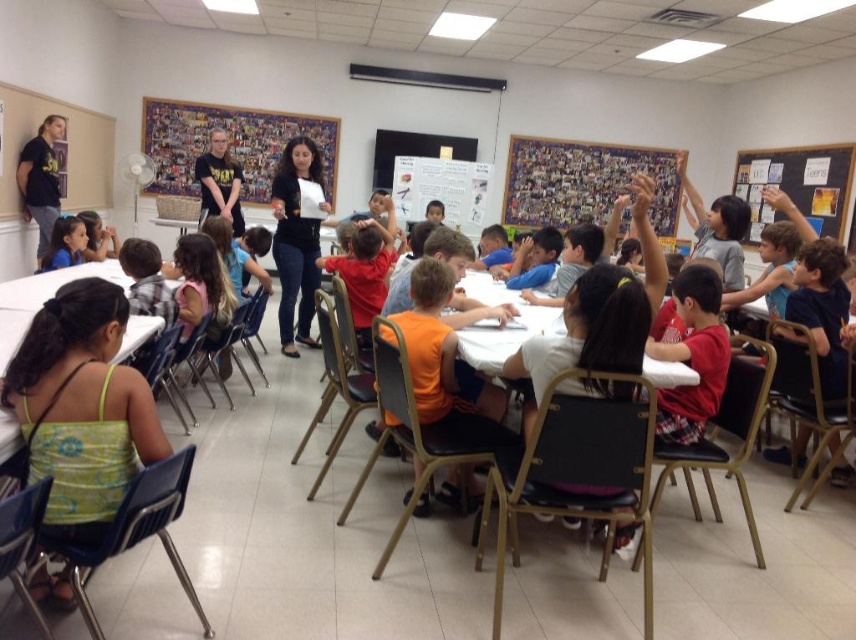
Question: Which point is farther from the camera taking this photo?

Choices:
 (A) (230, 198)
 (B) (74, 216)

Answer: (A)

Question: Observing the image, what is the correct spatial positioning of matte black shirt at upper center in reference to matte blue shirt at lower left?

Choices:
 (A) below
 (B) above

Answer: (B)

Question: Estimate the real-world distances between objects in this image. Which object is farther from the blackboard at upper right?

Choices:
 (A) collage paper collage at upper center
 (B) matte blue shirt at lower left

Answer: (B)

Question: Among these objects, which one is nearest to the camera?

Choices:
 (A) matte blue shirt at lower left
 (B) collage paper collage at upper center

Answer: (A)

Question: Can you confirm if blackboard at upper right is positioned below matte black shirt at upper center?

Choices:
 (A) no
 (B) yes

Answer: (A)

Question: Considering the relative positions of black fabric at center and matte black shirt at upper center in the image provided, where is black fabric at center located with respect to matte black shirt at upper center?

Choices:
 (A) below
 (B) above

Answer: (A)